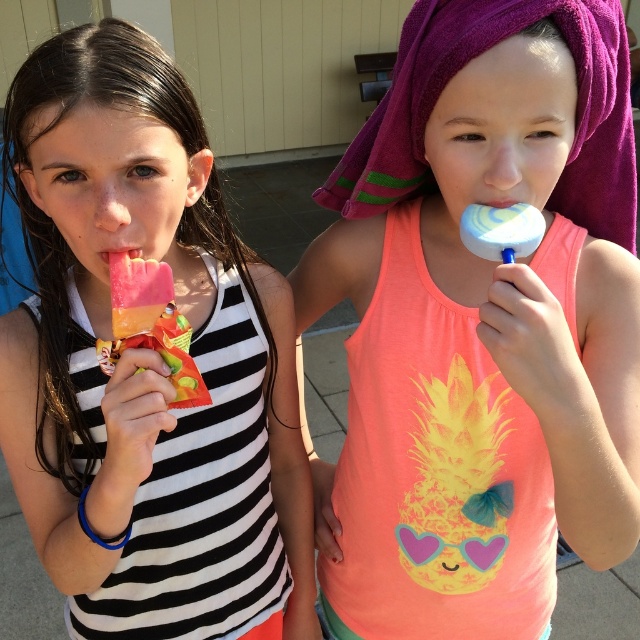
Is matte plastic popsicle at left above pink matte popsicle at center?

No.

Can you confirm if matte plastic popsicle at left is wider than pink matte popsicle at center?

Indeed, matte plastic popsicle at left has a greater width compared to pink matte popsicle at center.

Between point (125, 342) and point (122, 259), which one is positioned behind?

The point (125, 342) is more distant.

Image resolution: width=640 pixels, height=640 pixels. What are the coordinates of `matte plastic popsicle at left` in the screenshot? It's located at (150, 326).

Is pink matte popsicle at left above pink matte popsicle at center?

Incorrect, pink matte popsicle at left is not positioned above pink matte popsicle at center.

Describe the element at coordinates (147, 364) in the screenshot. I see `pink matte popsicle at left` at that location.

Describe the element at coordinates (147, 364) in the screenshot. The width and height of the screenshot is (640, 640). I see `pink matte popsicle at left` at that location.

At what (x,y) coordinates should I click in order to perform the action: click on pink matte popsicle at left. Please return your answer as a coordinate pair (x, y). Looking at the image, I should click on (147, 364).

Which of these two, matte blue lollipop at center or pink matte popsicle at center, stands taller?

With more height is matte blue lollipop at center.

Can you confirm if matte blue lollipop at center is positioned to the right of pink matte popsicle at center?

Yes, matte blue lollipop at center is to the right of pink matte popsicle at center.

Between point (346, 212) and point (118, 253), which one is positioned behind?

Point (346, 212)

The image size is (640, 640). Identify the location of matte blue lollipop at center. (483, 324).